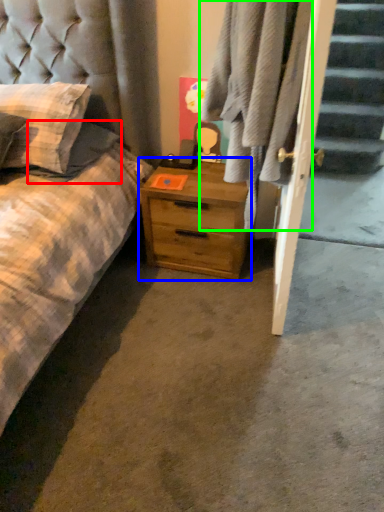
Question: Considering the real-world distances, which object is farthest from pillow (highlighted by a red box)? nightstand (highlighted by a blue box) or plaid (highlighted by a green box)?

Choices:
 (A) nightstand
 (B) plaid

Answer: (B)